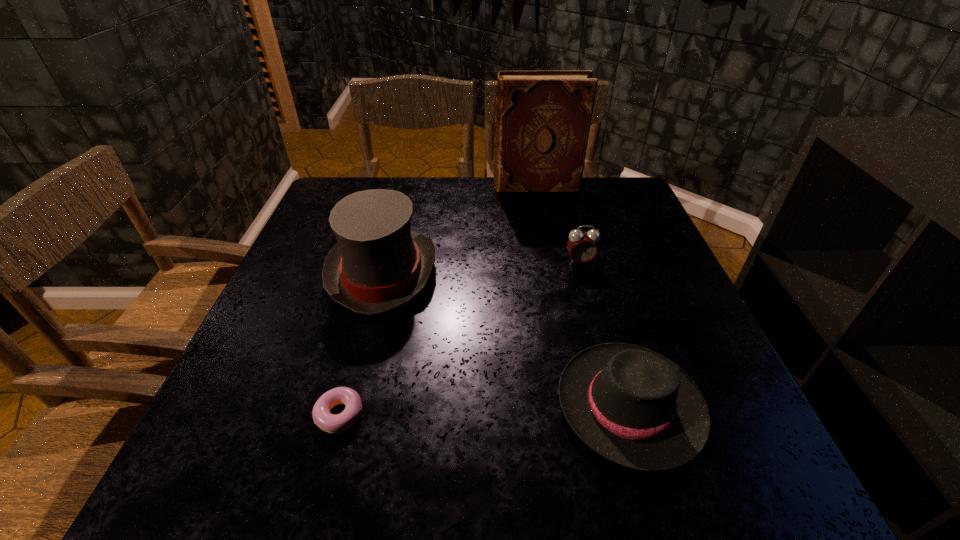
Locate an element on the screen. free space between the farthest object and the taller dress hat is located at coordinates (460, 230).

The image size is (960, 540). In order to click on free space between the shorter dress hat and the alarm clock in this screenshot , I will do `click(605, 334)`.

Find the location of a particular element. The height and width of the screenshot is (540, 960). free spot between the tallest object and the nearer dress hat is located at coordinates (583, 296).

Locate an element on the screen. Image resolution: width=960 pixels, height=540 pixels. free space that is in between the shorter dress hat and the alarm clock is located at coordinates (605, 334).

Locate an element on the screen. The height and width of the screenshot is (540, 960). vacant region between the right dress hat and the farthest object is located at coordinates pos(583,296).

This screenshot has width=960, height=540. I want to click on free space between the alarm clock and the shorter dress hat, so click(x=605, y=334).

Find the location of a particular element. This screenshot has height=540, width=960. empty location between the tallest object and the alarm clock is located at coordinates point(558,224).

This screenshot has height=540, width=960. Identify the location of free spot between the shorter dress hat and the alarm clock. (605, 334).

Image resolution: width=960 pixels, height=540 pixels. I want to click on object that is the third closest to the tallest object, so click(633, 406).

This screenshot has width=960, height=540. What are the coordinates of `object that is the closest one to the second tallest object` in the screenshot? It's located at 332,423.